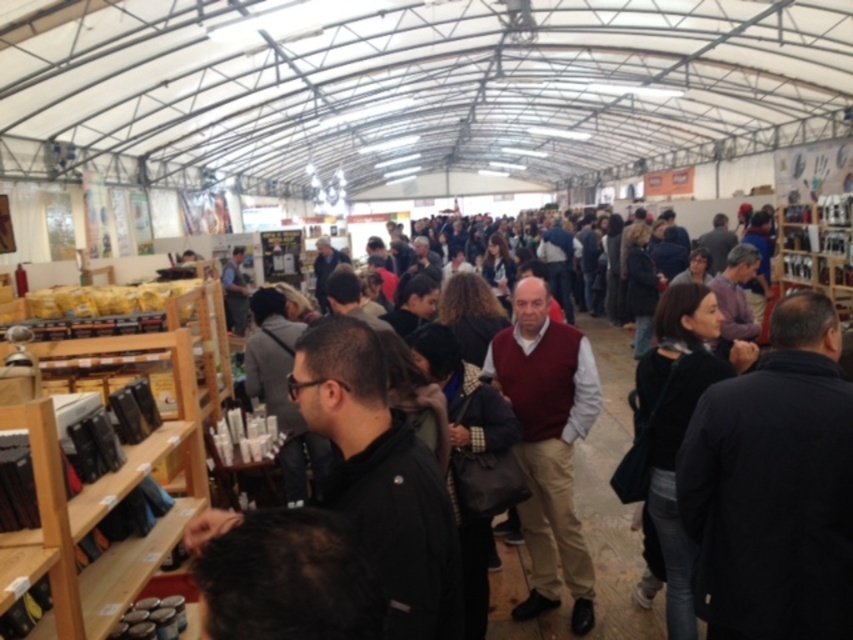
You are standing at the point marked by the coordinate point (125, 467) in the market. Which direction should you move to reach the wooden shelves at left?

The wooden shelves at left is located at the point marked by the coordinate point (125, 467), so you are already at the wooden shelves at left.

You are a delivery person carrying a box that is 2 meters long. You need to move from the wooden shelves at left to the maroon sweater at center. Is there enough space to move the box without tilting it?

The distance between the wooden shelves at left and maroon sweater at center is 2.31 meters. Since the box is 2 meters long, there is sufficient space to move it without tilting.

You are standing at the entrance of the market and see two points in the crowd. The first point is at coordinate point (49, 490) and the second is at coordinate point (561, 401). Which point is closer to you?

Point (49, 490) is closer to the viewer than point (561, 401).